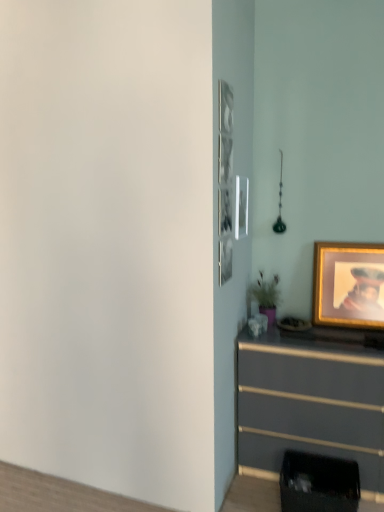
Question: Is gold-framed picture at right next to matte gray chest of drawers at lower right?

Choices:
 (A) yes
 (B) no

Answer: (B)

Question: Does gold-framed picture at right have a lesser height compared to matte gray chest of drawers at lower right?

Choices:
 (A) no
 (B) yes

Answer: (B)

Question: Can you confirm if gold-framed picture at right is smaller than matte gray chest of drawers at lower right?

Choices:
 (A) no
 (B) yes

Answer: (B)

Question: Does gold-framed picture at right lie in front of matte gray chest of drawers at lower right?

Choices:
 (A) yes
 (B) no

Answer: (B)

Question: Is gold-framed picture at right looking in the opposite direction of matte gray chest of drawers at lower right?

Choices:
 (A) yes
 (B) no

Answer: (B)

Question: Is matte gray chest of drawers at lower right completely or partially inside gold-framed picture at right?

Choices:
 (A) yes
 (B) no

Answer: (B)

Question: Is matte gray chest of drawers at lower right positioned before gold-framed picture at right?

Choices:
 (A) yes
 (B) no

Answer: (A)

Question: Is matte gray chest of drawers at lower right looking in the opposite direction of gold-framed picture at right?

Choices:
 (A) no
 (B) yes

Answer: (A)

Question: Is matte gray chest of drawers at lower right to the left of gold-framed picture at right from the viewer's perspective?

Choices:
 (A) no
 (B) yes

Answer: (B)

Question: Is matte gray chest of drawers at lower right wider than gold-framed picture at right?

Choices:
 (A) yes
 (B) no

Answer: (A)

Question: Does matte gray chest of drawers at lower right have a lesser width compared to gold-framed picture at right?

Choices:
 (A) yes
 (B) no

Answer: (B)

Question: From the image's perspective, is matte gray chest of drawers at lower right over gold-framed picture at right?

Choices:
 (A) yes
 (B) no

Answer: (B)

Question: Is matte gray chest of drawers at lower right taller or shorter than gold-framed picture at right?

Choices:
 (A) tall
 (B) short

Answer: (A)